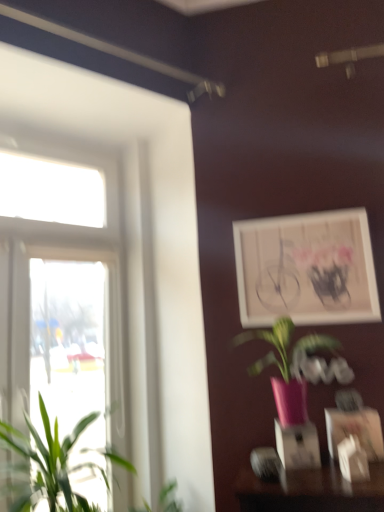
Locate an element on the screen. empty space that is ontop of clear glass window at left is located at coordinates (62, 126).